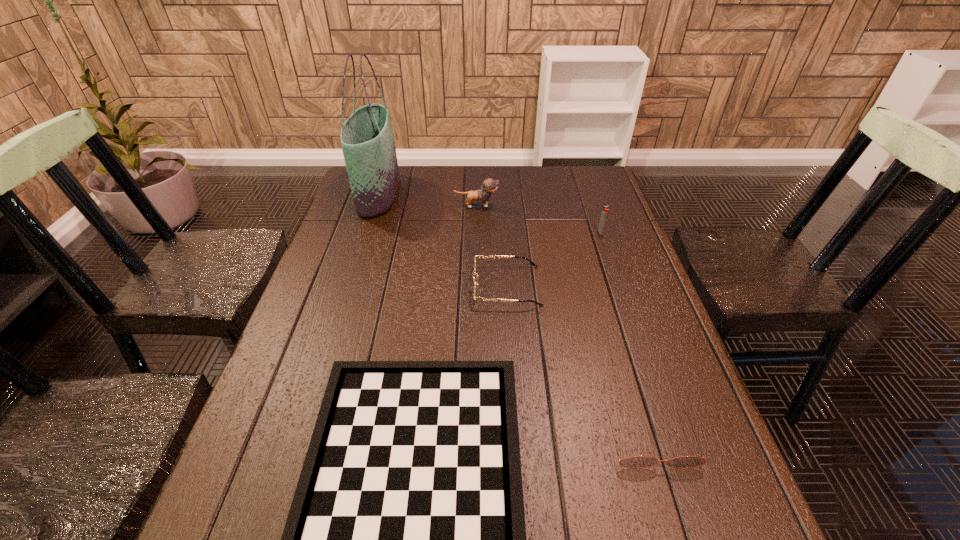
This screenshot has width=960, height=540. Identify the location of the tallest object. (367, 140).

Where is `kitten`? This screenshot has height=540, width=960. kitten is located at coordinates (489, 185).

Locate an element on the screen. The height and width of the screenshot is (540, 960). igniter is located at coordinates (604, 213).

You are a GUI agent. You are given a task and a screenshot of the screen. Output one action in this format:
    pyautogui.click(x=<x>, y=<y>)
    Task: Click on the fourth farthest object
    
    Given the screenshot: What is the action you would take?
    pyautogui.click(x=478, y=256)

This screenshot has width=960, height=540. In order to click on the third shortest object in this screenshot , I will do 478,256.

I want to click on the second shortest object, so click(x=637, y=461).

You are a GUI agent. You are given a task and a screenshot of the screen. Output one action in this format:
    pyautogui.click(x=<x>, y=<y>)
    Task: Click on the vacant space located on the right of the tallest object
    The image size is (960, 540).
    Given the screenshot: What is the action you would take?
    pyautogui.click(x=475, y=193)

Locate an element on the screen. free space located 0.360m on the front-facing side of the kitten is located at coordinates (610, 206).

Where is `vacant space located on the front of the third farthest object`? This screenshot has height=540, width=960. vacant space located on the front of the third farthest object is located at coordinates (634, 329).

At what (x,y) coordinates should I click in order to perform the action: click on free space located on the lenses of the spectacles. Please return your answer as a coordinate pair (x, y). Looking at the image, I should click on (372, 286).